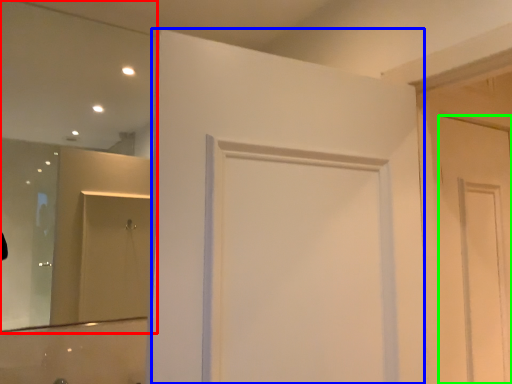
Question: Which is nearer to the mirror (highlighted by a red box)? door (highlighted by a blue box) or door (highlighted by a green box).

Choices:
 (A) door
 (B) door

Answer: (A)